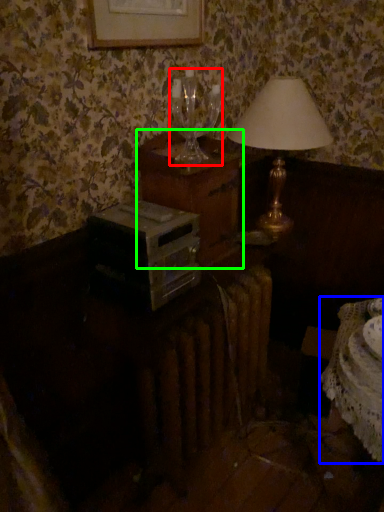
Question: Considering the real-world distances, which object is farthest from wine glass (highlighted by a red box)? table (highlighted by a blue box) or nightstand (highlighted by a green box)?

Choices:
 (A) table
 (B) nightstand

Answer: (A)